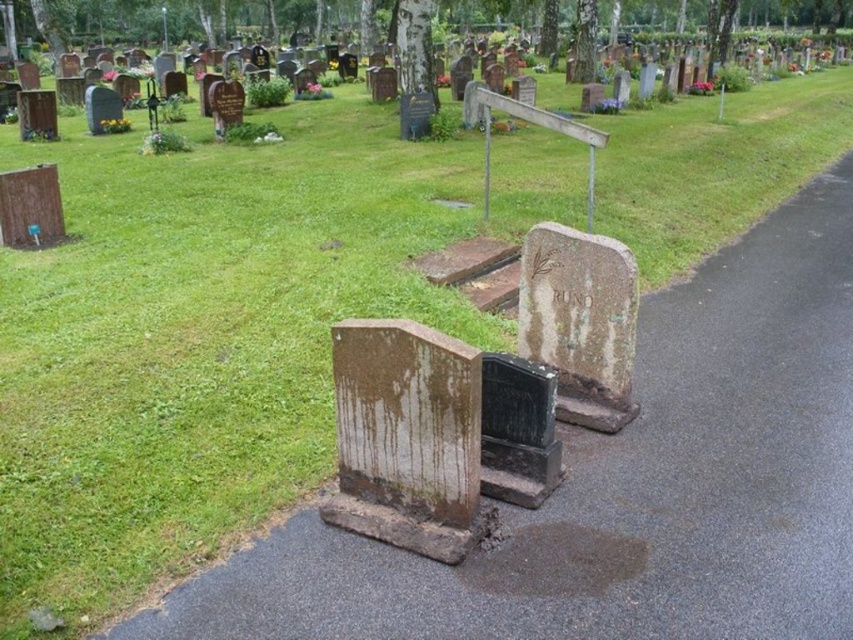
Question: Which point is closer to the camera?

Choices:
 (A) black stone gravestone at center
 (B) brown stone gravestone at center

Answer: (B)

Question: Which is nearer to the bronze textured gravestone at center?

Choices:
 (A) black stone gravestone at center
 (B) brown stone gravestone at center

Answer: (A)

Question: Considering the real-world distances, which object is closest to the black stone gravestone at center?

Choices:
 (A) brown stone gravestone at center
 (B) bronze textured gravestone at center

Answer: (A)

Question: Can you confirm if bronze textured gravestone at center is bigger than black stone gravestone at center?

Choices:
 (A) no
 (B) yes

Answer: (B)

Question: Is brown stone gravestone at center bigger than bronze textured gravestone at center?

Choices:
 (A) yes
 (B) no

Answer: (A)

Question: Can you confirm if bronze textured gravestone at center is positioned to the left of black stone gravestone at center?

Choices:
 (A) yes
 (B) no

Answer: (B)